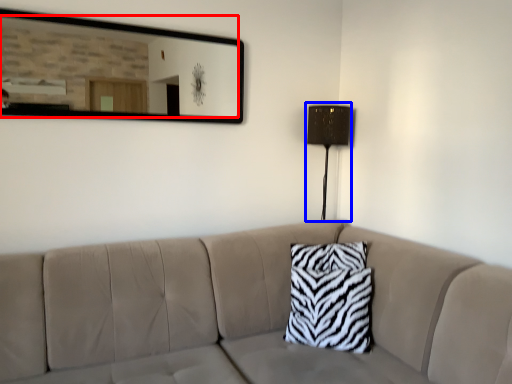
Question: Which of the following is the farthest to the observer, mirror (highlighted by a red box) or table lamp (highlighted by a blue box)?

Choices:
 (A) mirror
 (B) table lamp

Answer: (B)